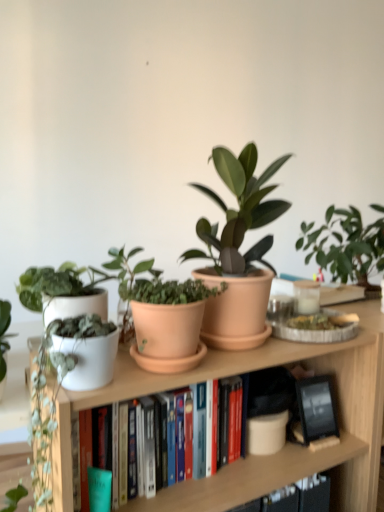
Question: Does white matte book at center come in front of matte terracotta pot at center, acting as the 3th houseplant starting from the left?

Choices:
 (A) yes
 (B) no

Answer: (A)

Question: Is white matte book at center positioned with its back to matte terracotta pot at center, acting as the 3th houseplant starting from the left?

Choices:
 (A) yes
 (B) no

Answer: (B)

Question: Is white matte book at center wider than matte terracotta pot at center, acting as the 3th houseplant starting from the left?

Choices:
 (A) no
 (B) yes

Answer: (A)

Question: Does white matte book at center have a lesser width compared to matte terracotta pot at center, acting as the 3th houseplant starting from the left?

Choices:
 (A) yes
 (B) no

Answer: (A)

Question: Is matte terracotta pot at center, acting as the 3th houseplant starting from the left, surrounded by white matte book at center?

Choices:
 (A) yes
 (B) no

Answer: (B)

Question: From a real-world perspective, is white matte pot at left, marked as the 3th houseplant in a right-to-left arrangement, above or below white matte plant pot at left?

Choices:
 (A) below
 (B) above

Answer: (B)

Question: Is white matte pot at left, which is the first houseplant from left to right, inside the boundaries of white matte plant pot at left, or outside?

Choices:
 (A) outside
 (B) inside

Answer: (A)

Question: Does point (41, 302) appear closer or farther from the camera than point (337, 478)?

Choices:
 (A) farther
 (B) closer

Answer: (B)

Question: Considering the positions of white matte pot at left, which is the first houseplant from left to right, and white matte plant pot at left in the image, is white matte pot at left, which is the first houseplant from left to right, wider or thinner than white matte plant pot at left?

Choices:
 (A) thin
 (B) wide

Answer: (A)

Question: From a real-world perspective, is white matte plant pot at left physically located above or below white matte pot at left, marked as the 3th houseplant in a right-to-left arrangement?

Choices:
 (A) below
 (B) above

Answer: (A)

Question: Relative to white matte pot at left, marked as the 3th houseplant in a right-to-left arrangement, is white matte plant pot at left in front or behind?

Choices:
 (A) behind
 (B) front

Answer: (B)

Question: Is white matte plant pot at left wider or thinner than white matte pot at left, which is the first houseplant from left to right?

Choices:
 (A) wide
 (B) thin

Answer: (A)

Question: Is white matte plant pot at left inside the boundaries of white matte pot at left, which is the first houseplant from left to right, or outside?

Choices:
 (A) outside
 (B) inside

Answer: (A)

Question: From the image's perspective, is white matte book at center located above or below white matte plant pot at left?

Choices:
 (A) above
 (B) below

Answer: (A)

Question: From a real-world perspective, relative to white matte plant pot at left, is white matte book at center vertically above or below?

Choices:
 (A) below
 (B) above

Answer: (B)